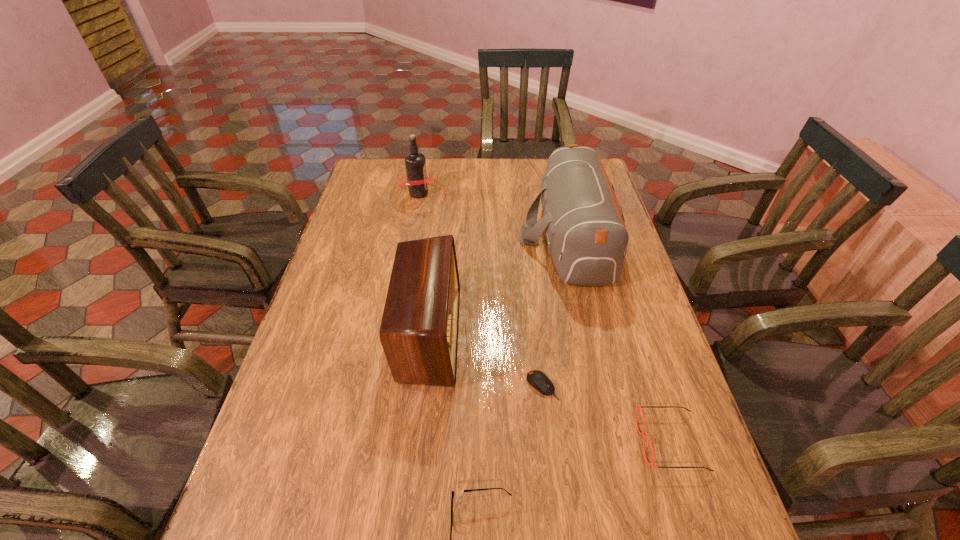
The image size is (960, 540). Find the location of `object that is the fourth closest one to the radio receiver`. object that is the fourth closest one to the radio receiver is located at coordinates (417, 181).

Select which object is the fourth closest to the farther spectacles. Please provide its 2D coordinates. Your answer should be formatted as a tuple, i.e. [(x, y)], where the tuple contains the x and y coordinates of a point satisfying the conditions above.

[(419, 328)]

This screenshot has width=960, height=540. I want to click on free space that satisfies the following two spatial constraints: 1. on the label of the root beer; 2. on the back side of the shortest object, so click(386, 386).

The height and width of the screenshot is (540, 960). I want to click on vacant point that satisfies the following two spatial constraints: 1. on the label of the root beer; 2. on the right side of the duffel bag, so click(412, 236).

Where is `free point that satisfies the following two spatial constraints: 1. on the label of the root beer; 2. on the back side of the computer mouse`? This screenshot has height=540, width=960. free point that satisfies the following two spatial constraints: 1. on the label of the root beer; 2. on the back side of the computer mouse is located at coordinates (386, 386).

Identify the location of vacant area in the image that satisfies the following two spatial constraints: 1. on the front-facing side of the radio receiver; 2. on the right side of the shortest object. (423, 386).

Identify the location of free space that satisfies the following two spatial constraints: 1. on the label of the duffel bag; 2. on the right side of the root beer. (412, 236).